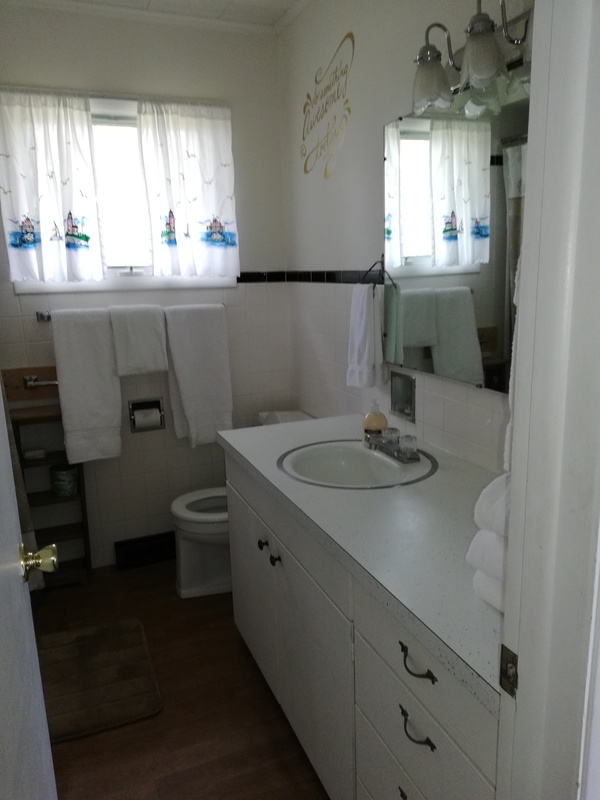
Find the location of a particular element. The image size is (600, 800). toilet paper holder is located at coordinates (148, 421).